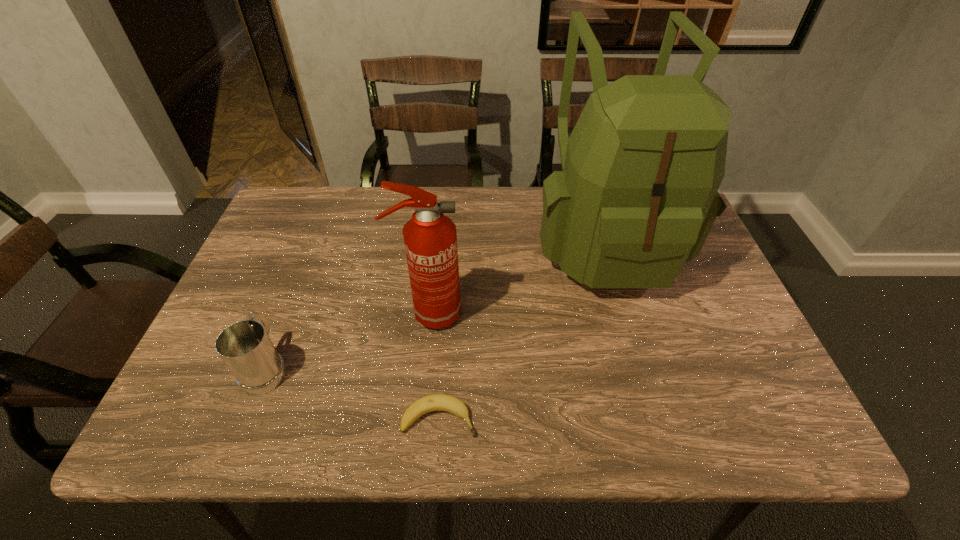
This screenshot has height=540, width=960. What are the coordinates of `the tallest object` in the screenshot? It's located at (637, 196).

Where is `the rightmost object`? This screenshot has height=540, width=960. the rightmost object is located at coordinates (637, 196).

Where is `fire extinguisher`? This screenshot has width=960, height=540. fire extinguisher is located at coordinates (430, 238).

Locate an element on the screen. This screenshot has height=540, width=960. the leftmost object is located at coordinates (245, 347).

Find the location of `mug`. mug is located at coordinates (245, 347).

Where is `banana`? The width and height of the screenshot is (960, 540). banana is located at coordinates (436, 402).

Image resolution: width=960 pixels, height=540 pixels. Identify the location of the shortest object. (x=436, y=402).

Locate an element on the screen. blank space located on the front pocket of the rightmost object is located at coordinates (646, 376).

Identify the location of free region located 0.170m at the nozzle of the fire extinguisher. (533, 314).

At what (x,y) coordinates should I click in order to perform the action: click on vacant point located on the side of the second nearest object with the handle. Please return your answer as a coordinate pair (x, y). The image size is (960, 540). Looking at the image, I should click on (289, 310).